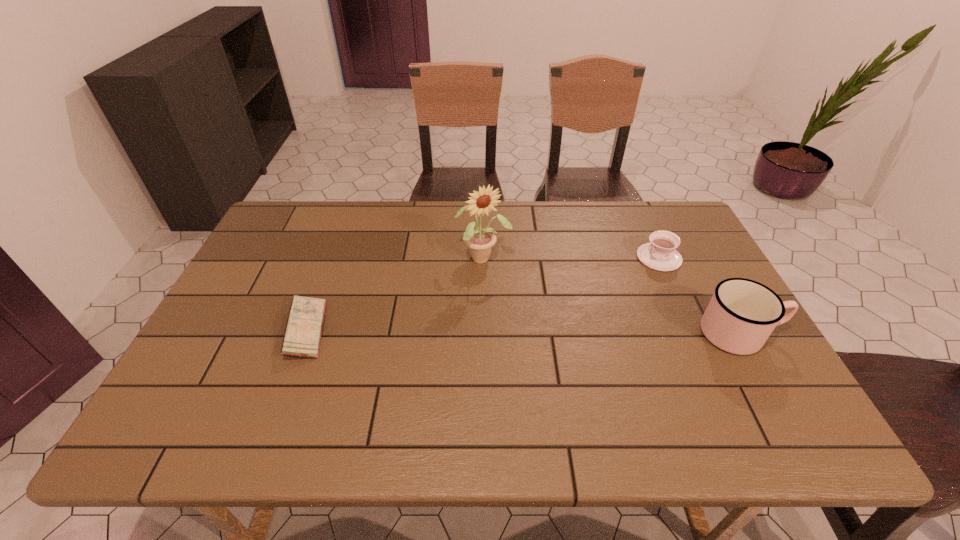
This screenshot has height=540, width=960. Find the location of `free space at the far left corner`. free space at the far left corner is located at coordinates pos(300,237).

This screenshot has width=960, height=540. In order to click on vacant space at the near left corner of the desktop in this screenshot , I will do `click(211, 381)`.

What are the coordinates of `free area in between the second tallest object and the leftmost object` in the screenshot? It's located at (523, 332).

Identify the location of free space between the third shortest object and the diary. (523, 332).

Image resolution: width=960 pixels, height=540 pixels. In order to click on vacant point located between the second object from left to right and the teacup in this screenshot , I will do `click(571, 258)`.

You are a GUI agent. You are given a task and a screenshot of the screen. Output one action in this format:
    pyautogui.click(x=<x>, y=<y>)
    Task: Click on the free spot between the teacup and the diary
    The image size is (960, 540).
    Given the screenshot: What is the action you would take?
    483,294

This screenshot has width=960, height=540. What are the coordinates of `empty space that is in between the second object from left to right and the mug` in the screenshot? It's located at (612, 296).

This screenshot has width=960, height=540. Find the location of `free area in between the mug and the leftmost object`. free area in between the mug and the leftmost object is located at coordinates (523, 332).

The image size is (960, 540). Identify the location of free space between the mug and the leftmost object. (523, 332).

Where is `blank region between the teacup and the sunflower`? Image resolution: width=960 pixels, height=540 pixels. blank region between the teacup and the sunflower is located at coordinates point(571,258).